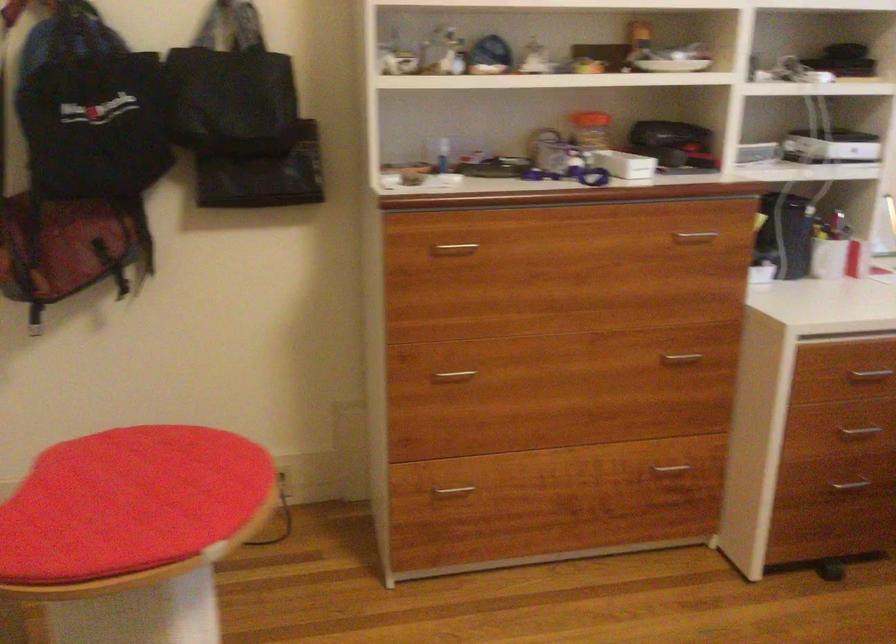
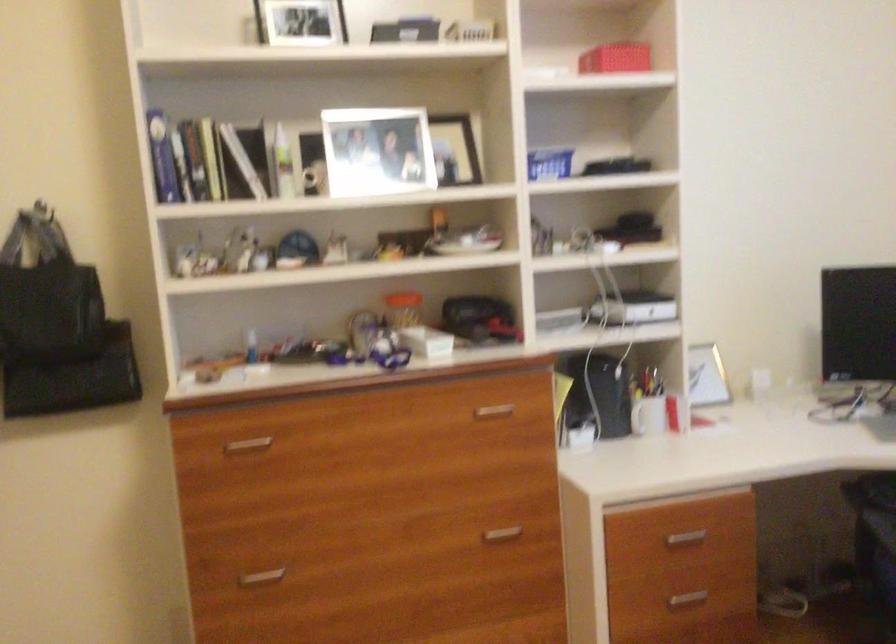
Question: The images are taken continuously from a first-person perspective. In which direction are you moving?

Choices:
 (A) Left
 (B) Right
 (C) Forward
 (D) Backward

Answer: (B)